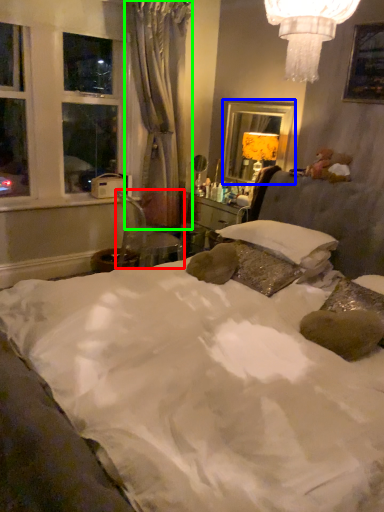
Question: Based on their relative distances, which object is nearer to chair (highlighted by a red box)? Choose from mirror (highlighted by a blue box) and curtain (highlighted by a green box).

Choices:
 (A) mirror
 (B) curtain

Answer: (B)